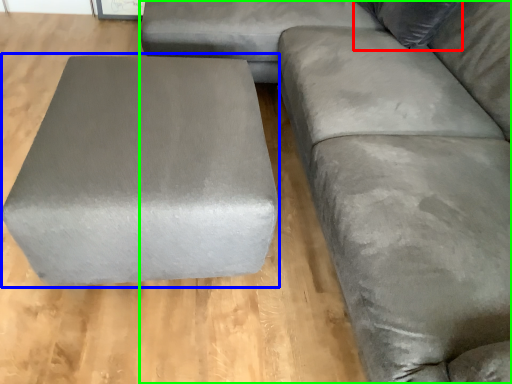
Question: Estimate the real-world distances between objects in this image. Which object is farther from pillow (highlighted by a red box), stool (highlighted by a blue box) or studio couch (highlighted by a green box)?

Choices:
 (A) stool
 (B) studio couch

Answer: (A)